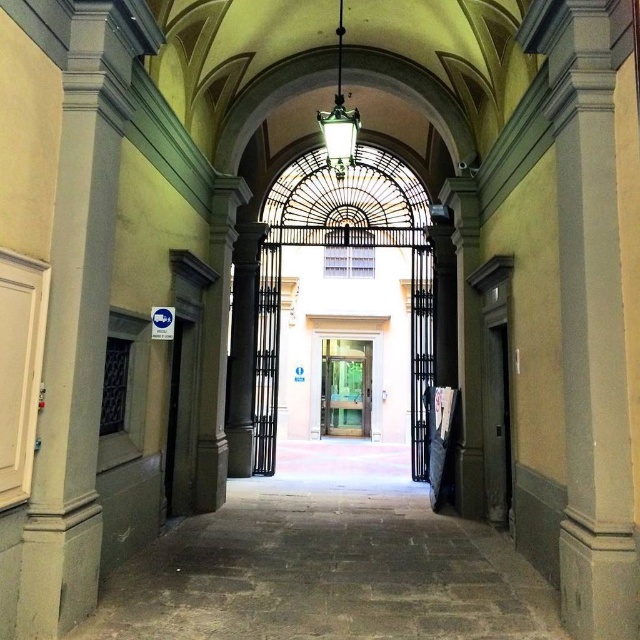
Can you confirm if dark gray wooden door at right is thinner than clear glass door at center?

Yes.

Describe the element at coordinates (496, 422) in the screenshot. The image size is (640, 640). I see `dark gray wooden door at right` at that location.

Which is in front, point (486, 346) or point (342, 426)?

Positioned in front is point (486, 346).

Where is `dark gray wooden door at right`? The image size is (640, 640). dark gray wooden door at right is located at coordinates (496, 422).